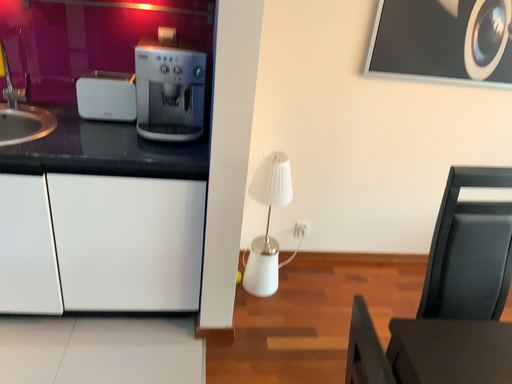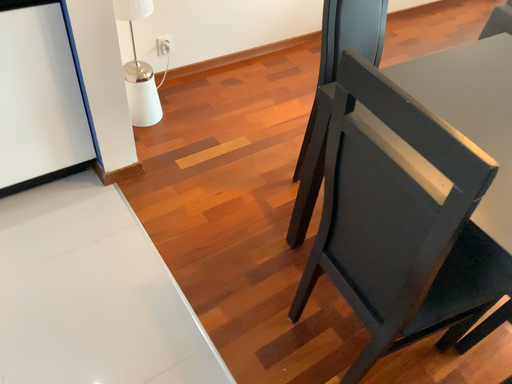
Question: How did the camera likely rotate when shooting the video?

Choices:
 (A) rotated downward
 (B) rotated upward

Answer: (A)